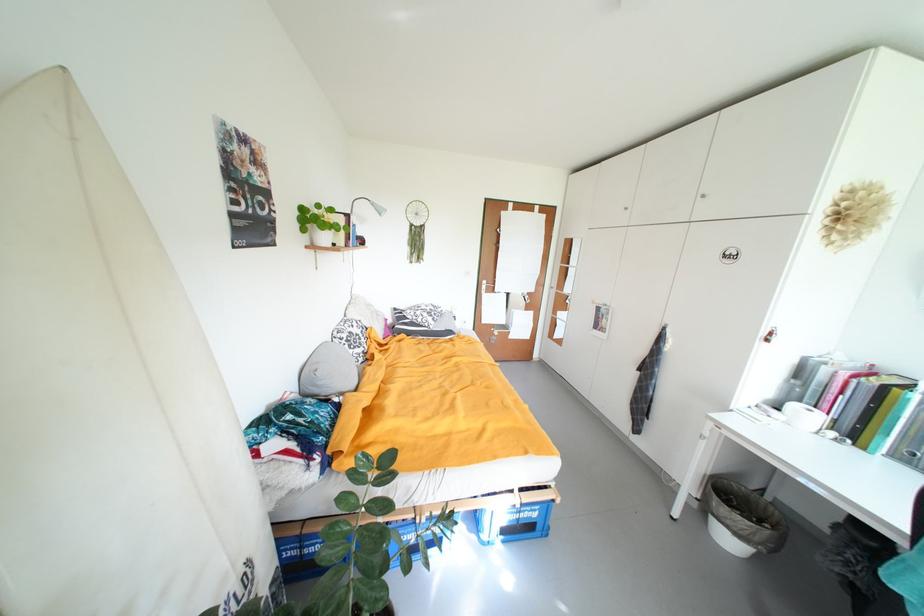
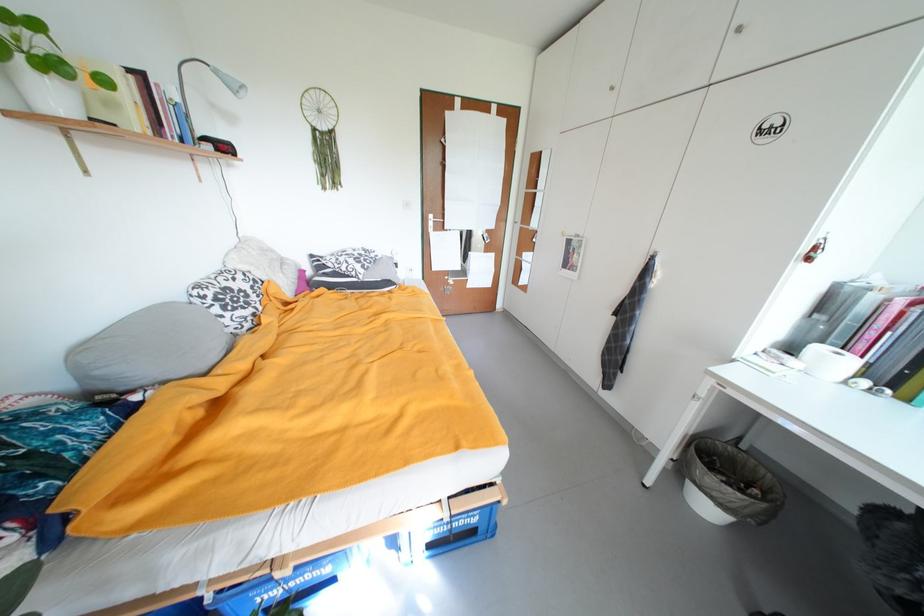
In the second image, find the point that corresponds to [326,385] in the first image.

(105, 374)